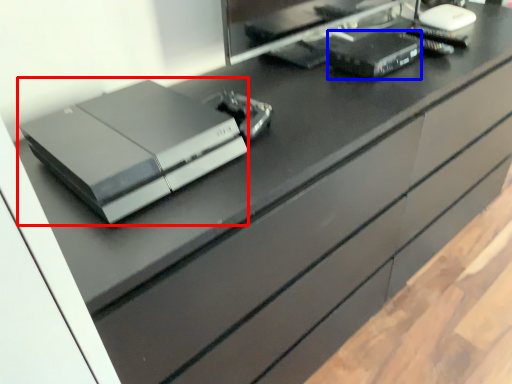
Question: Which object is further to the camera taking this photo, printer (highlighted by a red box) or equipment (highlighted by a blue box)?

Choices:
 (A) printer
 (B) equipment

Answer: (B)